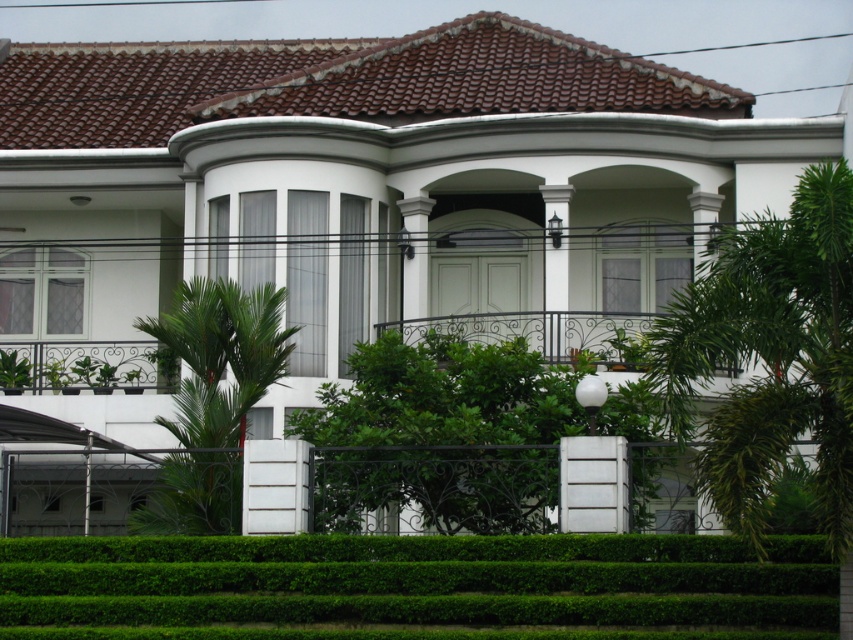
You are standing in front of the house and want to walk from the green leafy palm tree at right to the green leafy hedge at lower center. Which direction should you move?

You should move to the left because the green leafy hedge at lower center is to the left of the green leafy palm tree at right.